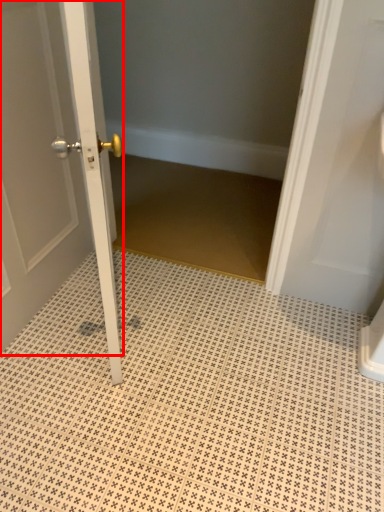
Question: Observing the image, what is the correct spatial positioning of door (annotated by the red box) in reference to ceramic tile?

Choices:
 (A) right
 (B) left

Answer: (B)